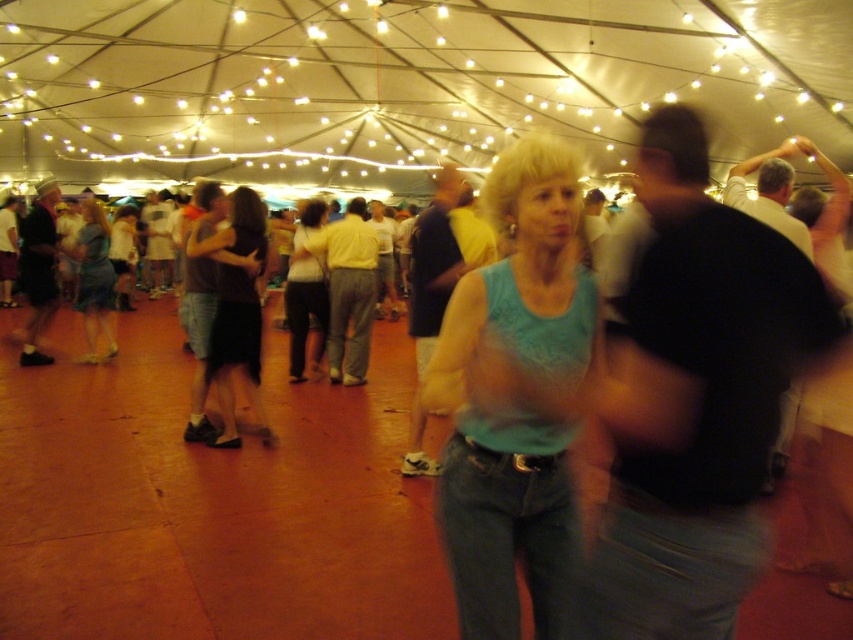
Which is behind, point (477, 518) or point (228, 288)?

Point (228, 288)

Between teal fabric tank top at center and dark brown skirt at center, which one appears on the right side from the viewer's perspective?

teal fabric tank top at center

Who is more distant from viewer, (573, 506) or (260, 435)?

The point (260, 435) is behind.

Find the location of a particular element. The width and height of the screenshot is (853, 640). teal fabric tank top at center is located at coordinates (511, 396).

Does dark brown skirt at center have a larger size compared to matte black dress at center?

Actually, dark brown skirt at center might be smaller than matte black dress at center.

Who is more distant from viewer, (241, 250) or (113, 344)?

Point (113, 344)

Image resolution: width=853 pixels, height=640 pixels. What are the coordinates of `dark brown skirt at center` in the screenshot? It's located at (236, 310).

Does teal fabric tank top at center have a smaller size compared to light blue fabric shirt at center?

Yes.

Does point (527, 138) come behind point (293, 310)?

No, (527, 138) is closer to viewer.

Which is behind, point (535, 458) or point (299, 301)?

The point (299, 301) is behind.

Identify the location of teal fabric tank top at center. (511, 396).